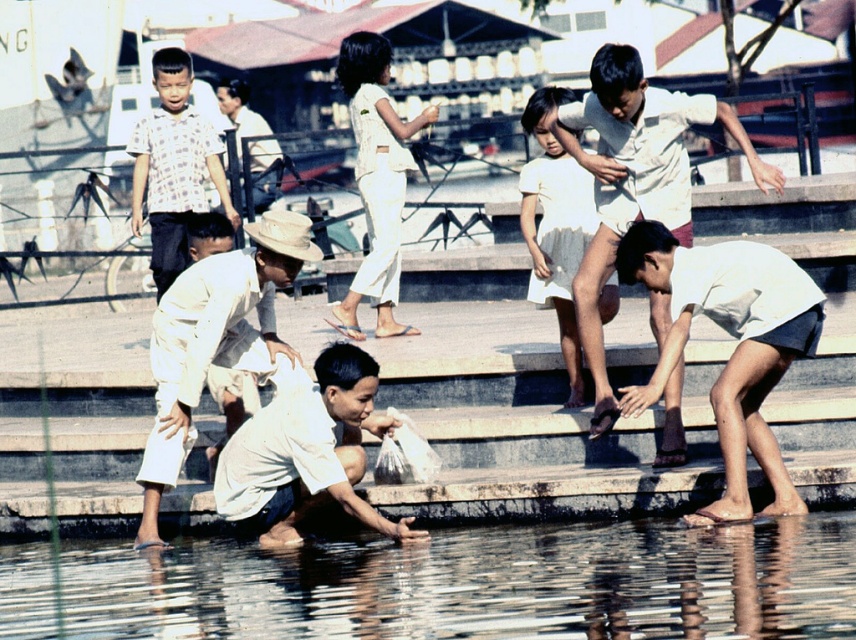
In the scene shown: You are a photographer standing at the top of the concrete steps leading down to the water. You want to take a photo that includes both the clear water at lower center and the white cotton dress at center. Which object should you focus on first to ensure both are in frame?

The clear water at lower center is further to the viewer than the white cotton dress at center, so focus on the clear water at lower center first to ensure both are in frame.

You are a photographer trying to capture a group shot of the children. You notice two children wearing white clothing. The first child is wearing a white matte shirt at lower center, and the second is wearing a white cotton dress at center. Since you want to ensure both are visible in the photo, which child might you position closer to the camera to avoid overlap with the other?

The white matte shirt at lower center might be wider than the white cotton dress at center, so positioning the child in the white matte shirt at lower center closer to the camera could prevent overlap with the narrower white cotton dress at center.